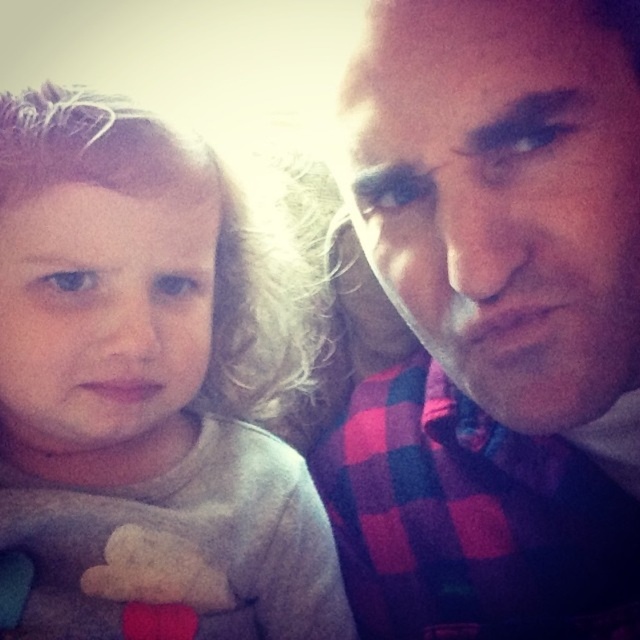
Question: Which object appears closest to the camera in this image?

Choices:
 (A) gray soft fabric at left
 (B) plaid fabric shirt at right

Answer: (B)

Question: Where is plaid fabric shirt at right located in relation to gray soft fabric at left in the image?

Choices:
 (A) below
 (B) above

Answer: (A)

Question: From the image, what is the correct spatial relationship of plaid fabric shirt at right in relation to gray soft fabric at left?

Choices:
 (A) above
 (B) below

Answer: (B)

Question: Is plaid fabric shirt at right positioned behind gray soft fabric at left?

Choices:
 (A) no
 (B) yes

Answer: (A)